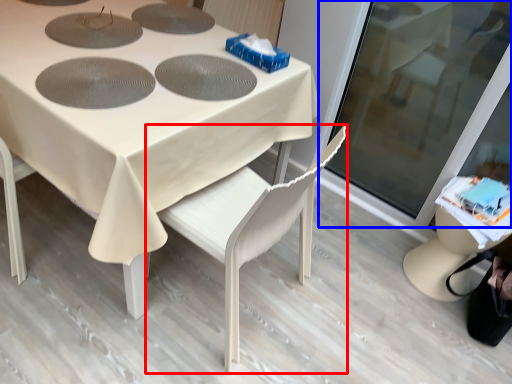
Question: Which object appears closest to the camera in this image, chair (highlighted by a red box) or screen door (highlighted by a blue box)?

Choices:
 (A) chair
 (B) screen door

Answer: (A)